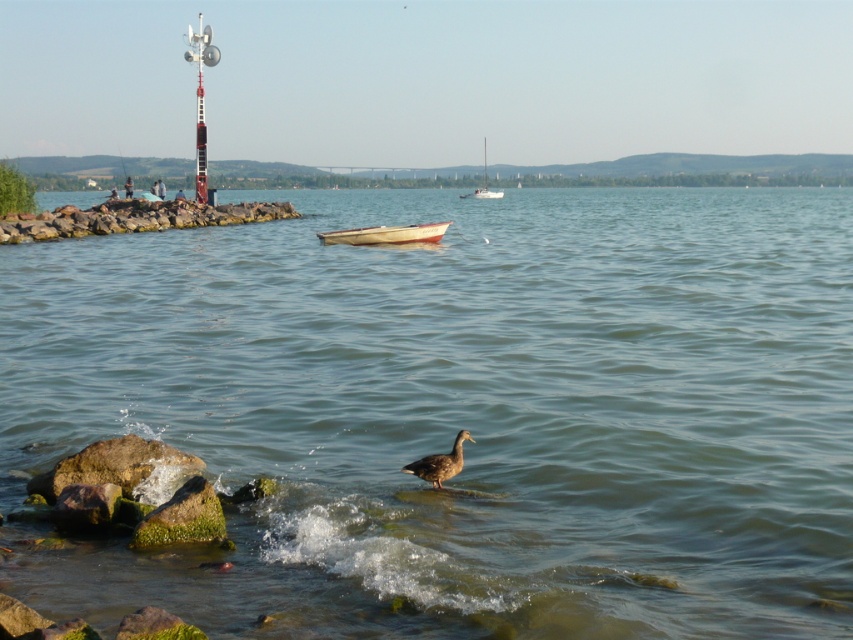
From the picture: Which is more to the left, greenish water at center or white sailboat at center?

Positioned to the left is greenish water at center.

Who is taller, greenish water at center or white sailboat at center?

Standing taller between the two is white sailboat at center.

Locate an element on the screen. greenish water at center is located at coordinates (462, 412).

Which is more to the left, greenish water at center or brown matte duck at center?

From the viewer's perspective, brown matte duck at center appears more on the left side.

Image resolution: width=853 pixels, height=640 pixels. What do you see at coordinates (462, 412) in the screenshot? I see `greenish water at center` at bounding box center [462, 412].

The image size is (853, 640). Identify the location of greenish water at center. (462, 412).

Does greenish water at center appear on the left side of white matte boat at center?

In fact, greenish water at center is to the right of white matte boat at center.

Does greenish water at center have a smaller size compared to white matte boat at center?

No.

What do you see at coordinates (462, 412) in the screenshot?
I see `greenish water at center` at bounding box center [462, 412].

At what (x,y) coordinates should I click in order to perform the action: click on greenish water at center. Please return your answer as a coordinate pair (x, y). This screenshot has height=640, width=853. Looking at the image, I should click on (462, 412).